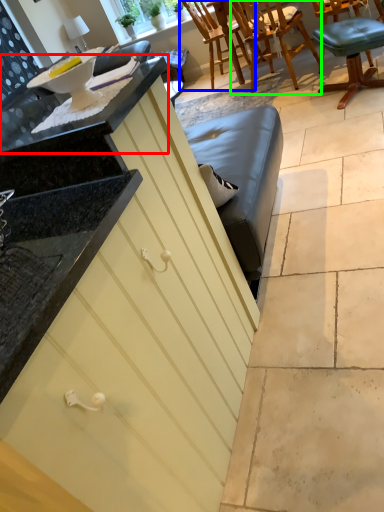
Question: Based on their relative distances, which object is nearer to countertop (highlighted by a red box)? Choose from chair (highlighted by a blue box) and chair (highlighted by a green box).

Choices:
 (A) chair
 (B) chair

Answer: (B)